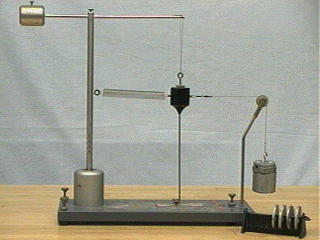
This screenshot has height=240, width=320. Identify the location of screws. (232, 194), (63, 187), (62, 199), (32, 1).